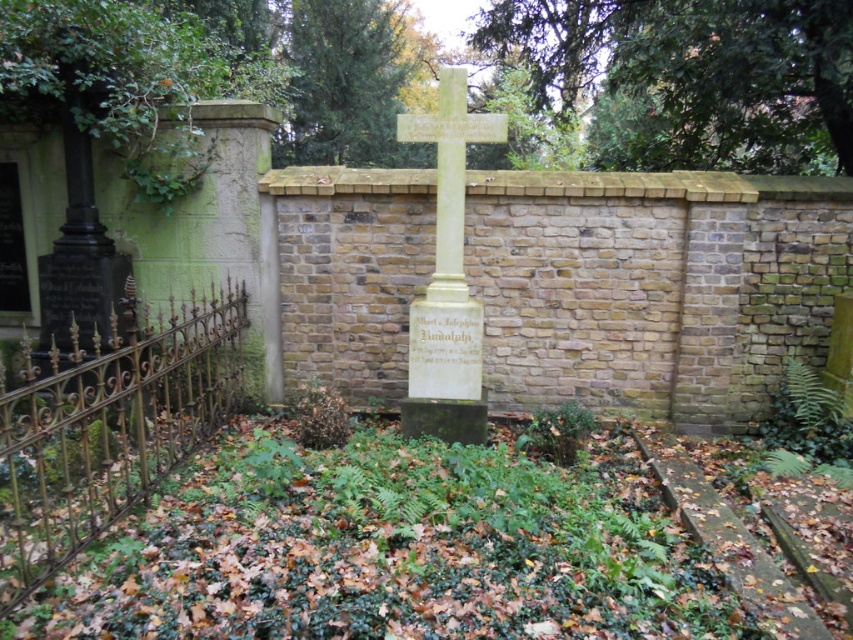
Question: Which object is closer to the camera taking this photo?

Choices:
 (A) gold wrought iron fence at left
 (B) light yellow stone cross at center

Answer: (A)

Question: Does gold wrought iron fence at left have a greater width compared to light yellow stone cross at center?

Choices:
 (A) yes
 (B) no

Answer: (A)

Question: Can you confirm if gold wrought iron fence at left is positioned below light yellow stone cross at center?

Choices:
 (A) no
 (B) yes

Answer: (B)

Question: Is gold wrought iron fence at left to the right of light yellow stone cross at center from the viewer's perspective?

Choices:
 (A) no
 (B) yes

Answer: (A)